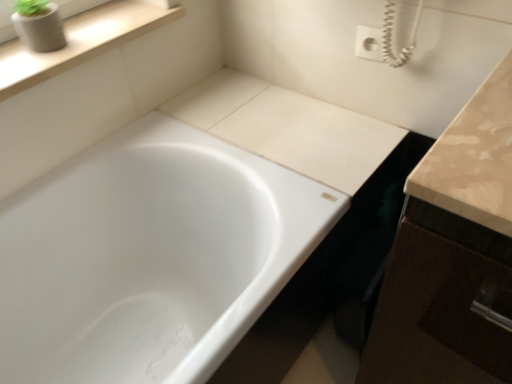
At what (x,y) coordinates should I click in order to perform the action: click on white glossy bathtub at center. Please return your answer as a coordinate pair (x, y). This screenshot has width=512, height=384. Looking at the image, I should click on (150, 257).

Does matte gray concrete planter at upper left have a smaller size compared to wooden at upper left?

Indeed, matte gray concrete planter at upper left has a smaller size compared to wooden at upper left.

Find the location of a particular element. window frame that is above the wooden at upper left (from a real-world perspective) is located at coordinates (76, 6).

From the image's perspective, is matte gray concrete planter at upper left beneath wooden at upper left?

Incorrect, from the image's perspective, matte gray concrete planter at upper left is higher than wooden at upper left.

How distant is white glossy bathtub at center from matte gray concrete planter at upper left?

The distance of white glossy bathtub at center from matte gray concrete planter at upper left is 65.17 centimeters.

Which is in front, point (167, 339) or point (12, 38)?

The point (12, 38) is more forward.

Find the location of a particular element. The width and height of the screenshot is (512, 384). bathtub on the right of the matte gray concrete planter at upper left is located at coordinates click(150, 257).

Can you confirm if white glossy bathtub at center is smaller than matte gray concrete planter at upper left?

Actually, white glossy bathtub at center might be larger than matte gray concrete planter at upper left.

In terms of size, does wooden at upper left appear bigger or smaller than white glossy bathtub at center?

wooden at upper left is smaller than white glossy bathtub at center.

Which object is positioned more to the left, wooden at upper left or white glossy bathtub at center?

Positioned to the left is wooden at upper left.

Considering the sizes of wooden at upper left and white glossy bathtub at center in the image, is wooden at upper left taller or shorter than white glossy bathtub at center?

In the image, wooden at upper left appears to be shorter than white glossy bathtub at center.

Is wooden at upper left not near white glossy bathtub at center?

No, wooden at upper left is not far away from white glossy bathtub at center.

Does point (207, 306) lie behind point (12, 90)?

Yes, it is.

From a real-world perspective, who is located higher, white glossy bathtub at center or wooden at upper left?

wooden at upper left is physically above.

Is white glossy bathtub at center to the right of wooden at upper left from the viewer's perspective?

Correct, you'll find white glossy bathtub at center to the right of wooden at upper left.

Is white glossy bathtub at center positioned with its back to wooden at upper left?

white glossy bathtub at center is not turned away from wooden at upper left.

Between point (60, 12) and point (163, 342), which one is positioned behind?

Positioned behind is point (163, 342).

Does matte gray concrete planter at upper left appear on the left side of white glossy bathtub at center?

Correct, you'll find matte gray concrete planter at upper left to the left of white glossy bathtub at center.

From the image's perspective, is matte gray concrete planter at upper left positioned above or below white glossy bathtub at center?

matte gray concrete planter at upper left is situated higher than white glossy bathtub at center in the image.

Would you consider wooden at upper left to be distant from matte gray concrete planter at upper left?

No, wooden at upper left is not far from matte gray concrete planter at upper left.

Is wooden at upper left wider or thinner than matte gray concrete planter at upper left?

Considering their sizes, wooden at upper left looks broader than matte gray concrete planter at upper left.

In terms of size, does wooden at upper left appear bigger or smaller than matte gray concrete planter at upper left?

Clearly, wooden at upper left is larger in size than matte gray concrete planter at upper left.

Considering the points (104, 49) and (11, 28), which point is behind, point (104, 49) or point (11, 28)?

The point (104, 49) is behind.

Locate an element on the screen. window sill lying below the matte gray concrete planter at upper left (from the image's perspective) is located at coordinates (80, 42).

The width and height of the screenshot is (512, 384). I want to click on bathtub on the right of the matte gray concrete planter at upper left, so click(150, 257).

Estimate the real-world distances between objects in this image. Which object is further from wooden at upper left, matte gray concrete planter at upper left or white glossy bathtub at center?

white glossy bathtub at center lies further to wooden at upper left than the other object.

Which object lies nearer to the anchor point matte gray concrete planter at upper left, white glossy bathtub at center or wooden at upper left?

wooden at upper left lies closer to matte gray concrete planter at upper left than the other object.

From the image, which object appears to be nearer to wooden at upper left, white glossy bathtub at center or matte gray concrete planter at upper left?

matte gray concrete planter at upper left is closer to wooden at upper left.

Looking at the image, which one is located further to matte gray concrete planter at upper left, wooden at upper left or white glossy bathtub at center?

Among the two, white glossy bathtub at center is located further to matte gray concrete planter at upper left.

Considering their positions, is matte gray concrete planter at upper left positioned further to white glossy bathtub at center than wooden at upper left?

matte gray concrete planter at upper left is positioned further to the anchor white glossy bathtub at center.

Considering their positions, is wooden at upper left positioned further to white glossy bathtub at center than matte gray concrete planter at upper left?

Based on the image, matte gray concrete planter at upper left appears to be further to white glossy bathtub at center.

Find the location of a particular element. The width and height of the screenshot is (512, 384). window sill between matte gray concrete planter at upper left and white glossy bathtub at center in the up-down direction is located at coordinates (80, 42).